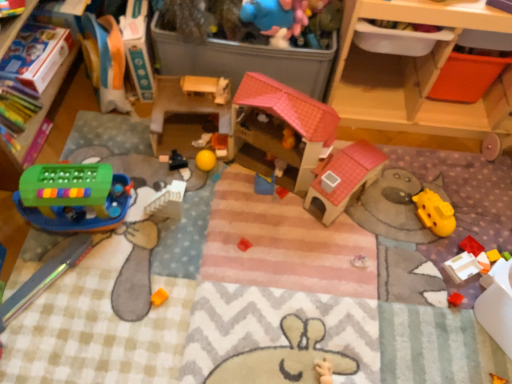
Where is `vacant space behind bright red plastic block at lower right, which appears as the first toy when viewed from the right`? The height and width of the screenshot is (384, 512). vacant space behind bright red plastic block at lower right, which appears as the first toy when viewed from the right is located at coordinates point(465,205).